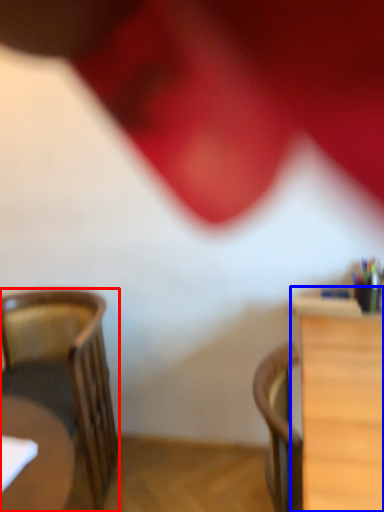
Question: Among these objects, which one is farthest to the camera, chair (highlighted by a red box) or table (highlighted by a blue box)?

Choices:
 (A) chair
 (B) table

Answer: (A)